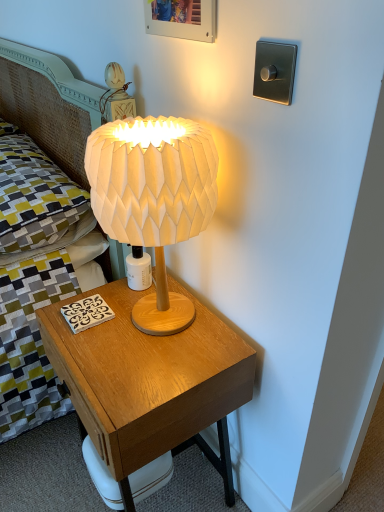
At what (x,y) coordinates should I click in order to perform the action: click on vacant area that is in front of white paper lampshade at center. Please return your answer as a coordinate pair (x, y). Looking at the image, I should click on (149, 374).